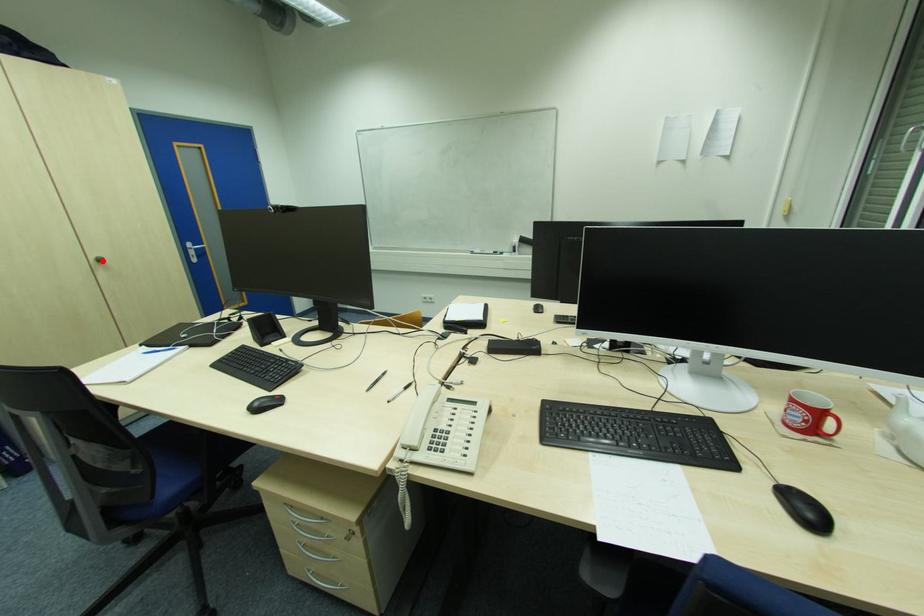
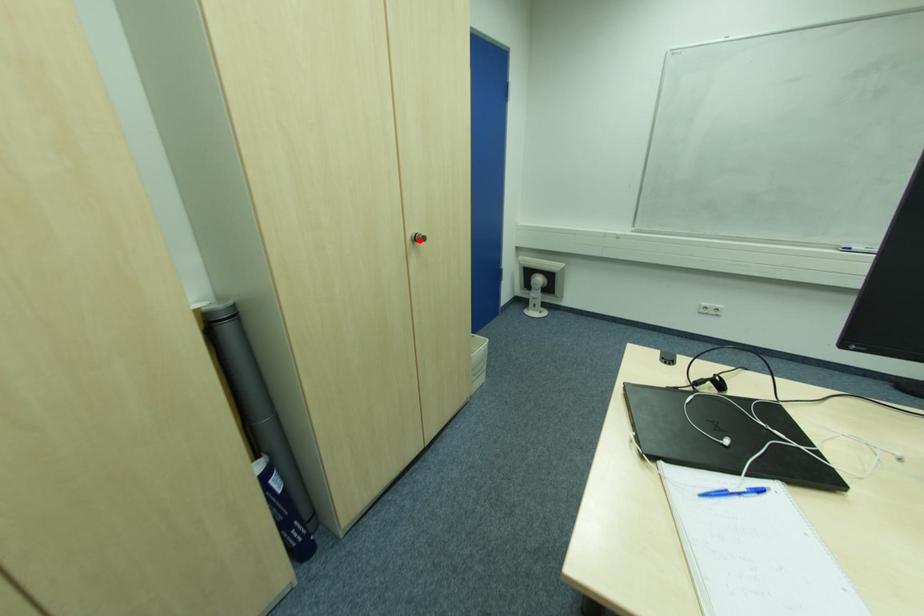
I am providing you with two images of the same scene from different viewpoints. A red point is marked on the first image and another point is marked on the second image. Are the points marked in image1 and image2 representing the same 3D position?

Yes